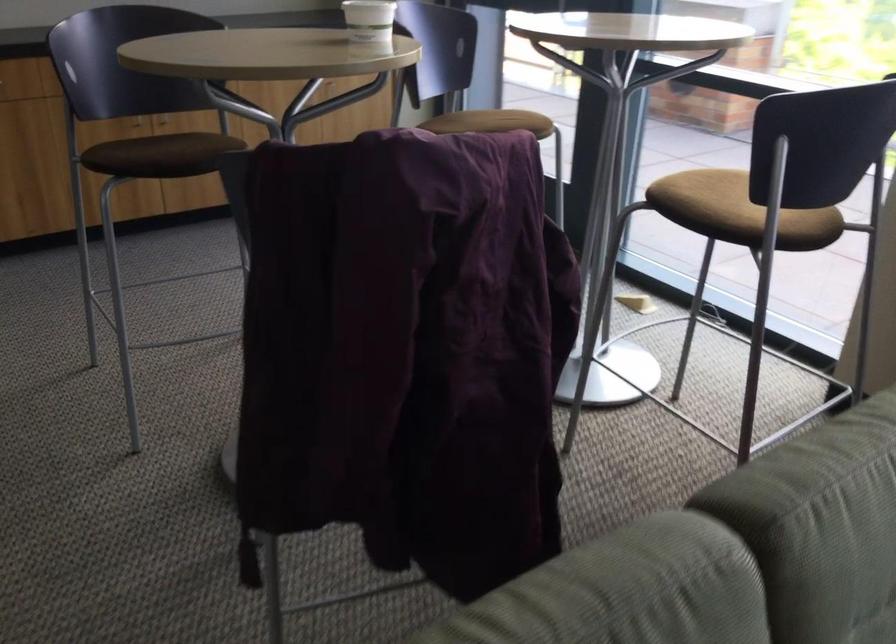
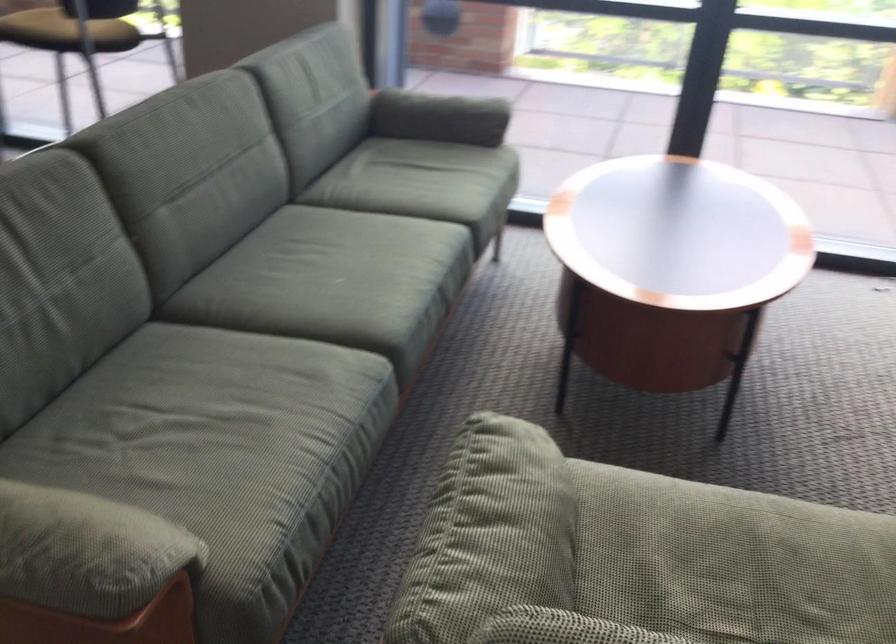
Question: The camera is either moving clockwise (left) or counter-clockwise (right) around the object. The first image is from the beginning of the video and the second image is from the end. Is the camera moving left or right when shooting the video?

Choices:
 (A) Left
 (B) Right

Answer: (A)